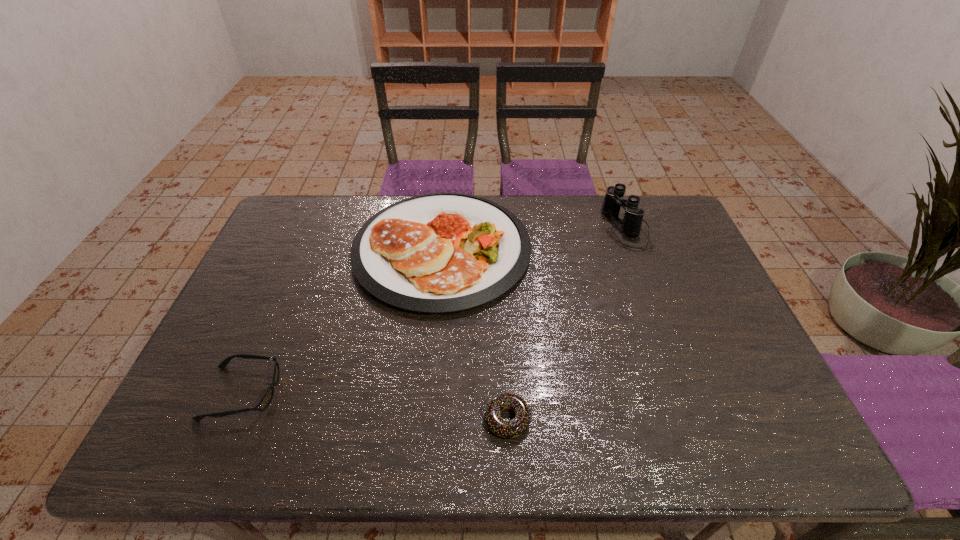
Identify the location of binoculars located at the far edge. This screenshot has width=960, height=540. (631, 224).

At what (x,y) coordinates should I click in order to perform the action: click on dish that is at the far edge. Please return your answer as a coordinate pair (x, y). The width and height of the screenshot is (960, 540). Looking at the image, I should click on (437, 253).

Locate an element on the screen. This screenshot has height=540, width=960. spectacles located in the near edge section of the desktop is located at coordinates (268, 396).

You are a GUI agent. You are given a task and a screenshot of the screen. Output one action in this format:
    pyautogui.click(x=<x>, y=<y>)
    Task: Click on the doughnut located at the near edge
    This screenshot has width=960, height=540.
    Given the screenshot: What is the action you would take?
    pyautogui.click(x=507, y=429)

Image resolution: width=960 pixels, height=540 pixels. Find the location of `object at the left edge`. object at the left edge is located at coordinates (268, 396).

Locate an element on the screen. Image resolution: width=960 pixels, height=540 pixels. object that is positioned at the right edge is located at coordinates (631, 224).

This screenshot has height=540, width=960. What are the coordinates of `object present at the near left corner` in the screenshot? It's located at (268, 396).

You are a GUI agent. You are given a task and a screenshot of the screen. Output one action in this format:
    pyautogui.click(x=<x>, y=<y>)
    Task: Click on the object present at the far right corner
    Image resolution: width=960 pixels, height=540 pixels.
    Given the screenshot: What is the action you would take?
    pyautogui.click(x=631, y=224)

I want to click on free space at the far edge of the desktop, so click(587, 197).

At what (x,y) coordinates should I click in order to perform the action: click on vacant space at the near edge of the desktop. Please return your answer as a coordinate pair (x, y). The width and height of the screenshot is (960, 540). Looking at the image, I should click on (474, 440).